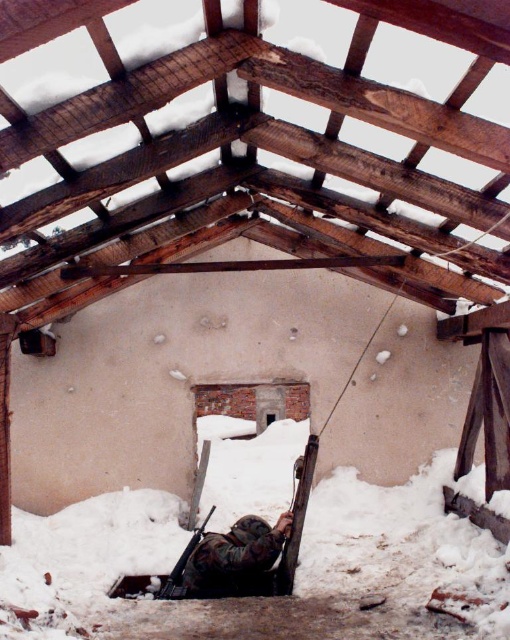
You are standing inside the collapsed wooden structure. You want to place a small wooden box on the floor. Where should you place it to avoid the white powdery snow at lower center?

Place the small wooden box away from the white powdery snow at lower center, which is located at point coordinates of [400,545]. The snow is at lower center, so placing the box elsewhere on the floor would avoid it.

You are a photographer standing at the entrance of the collapsed barn. You see the camouflage fabric uniform at center and want to place your camera next to it. Is there enough space between them to move freely?

The camouflage fabric uniform at center and camera are 20.45 feet apart from each other, so there is plenty of space to move freely between them.

You are a hiker lost in the woods and you come across this collapsed structure. You see the white powdery snow at lower center and the camouflage fabric uniform at center. Which object is positioned to the left of the other?

The camouflage fabric uniform at center is positioned to the left of the white powdery snow at lower center because the snow is to the right of the uniform.